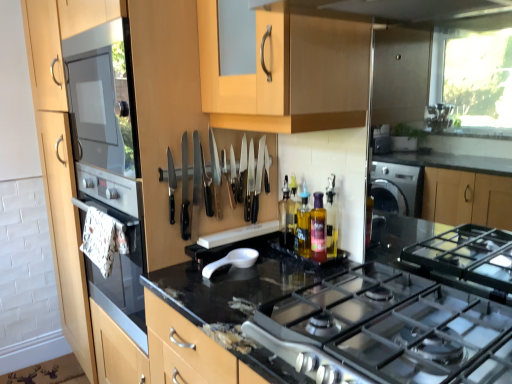
Image resolution: width=512 pixels, height=384 pixels. I want to click on free location to the left of white matte spoon at center, so click(176, 278).